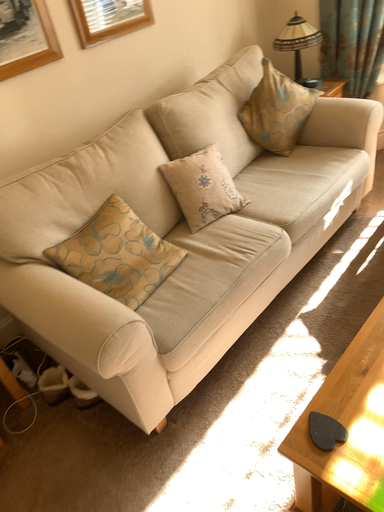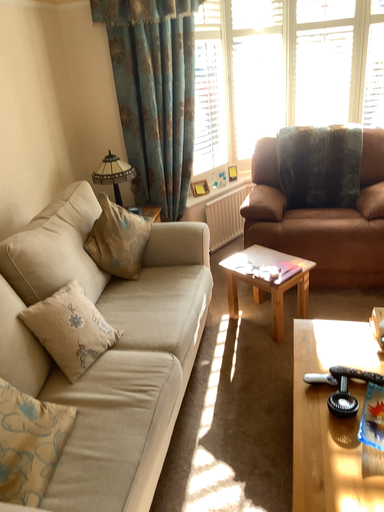
Question: How did the camera likely rotate when shooting the video?

Choices:
 (A) rotated downward
 (B) rotated upward

Answer: (B)